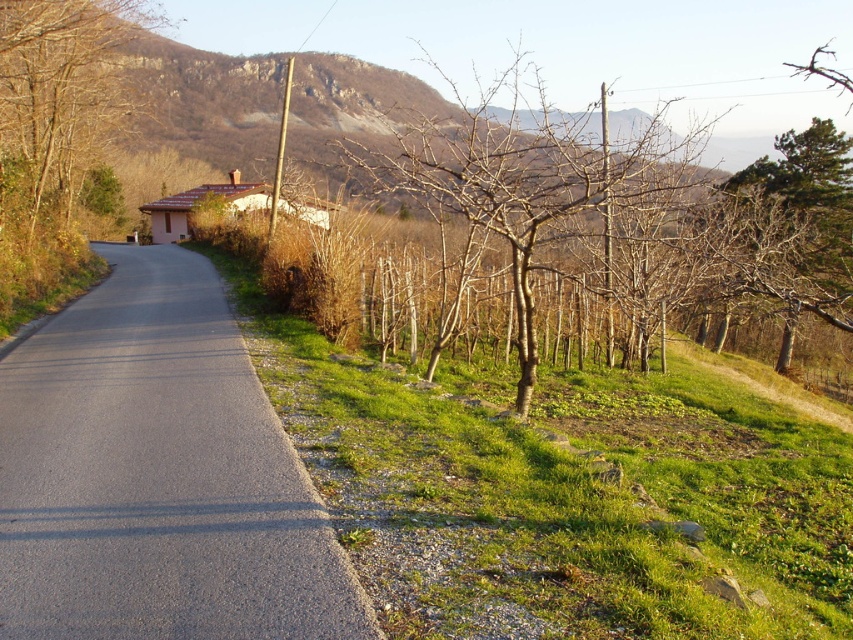
You are standing at the viewer position in the scene. There is a point marked at coordinates point (244, 474). Can you reach that point within 10 meters of walking distance?

The distance between point (244, 474) and the viewer is 6.40 meters, so yes, you can reach it within 10 meters of walking distance.

You are a painter standing on the gray asphalt road at center and want to paint the bare wood tree at center. Which object is taller between them?

The bare wood tree at center is taller than the gray asphalt road at center.

You are a pedestrian standing at the edge of the gray asphalt road at center and want to walk towards the brown leafless tree at upper left. Which direction should you face to reach it?

You should face upwards because the gray asphalt road at center is located below the brown leafless tree at upper left, so walking in that direction will lead you toward it.